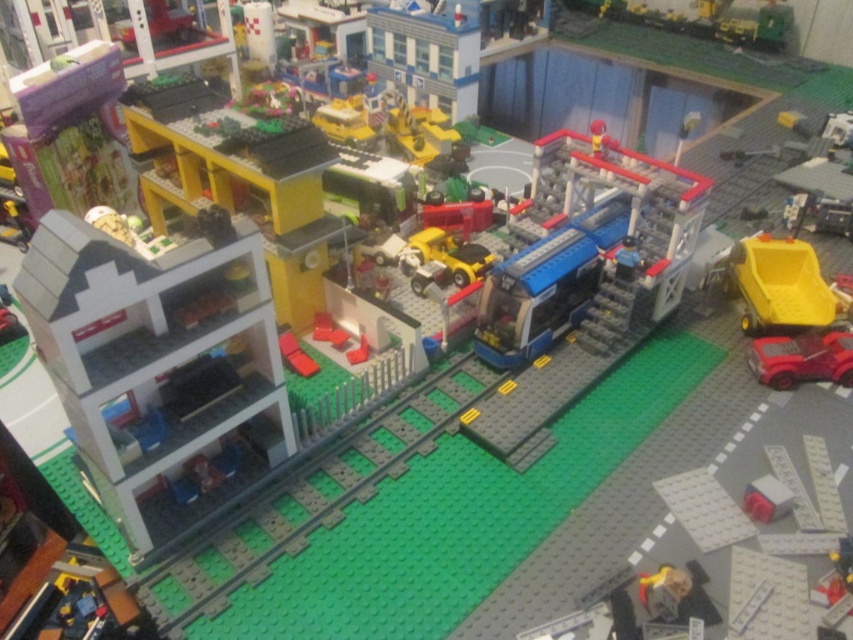
You are a Lego figure standing at the bus stop next to the blue plastic bus at center. You need to get to the shiny red car at lower right. Can you easily walk around the bus to reach the car without moving the bus?

The blue plastic bus at center is positioned over the shiny red car at lower right, so the car is underneath the bus. You cannot easily walk around the bus to reach the shiny red car at lower right because it is blocked by the bus.

You are a Lego figure standing at the bus stop next to the blue plastic bus at center. You want to get to the shiny red car at lower right. Which direction should you walk to reach it?

The blue plastic bus at center is to the left of the shiny red car at lower right, so you should walk to the right to reach the shiny red car at lower right.

You are standing at point A, which is at coordinates point (648, 161), and you want to walk to point B at coordinates point (822, 364). Which direction should you move to reach point B from point A?

To move from point A at coordinates point (648, 161) to point B at coordinates point (822, 364), you should move towards the upper right direction since point B is located to the upper right of point A.